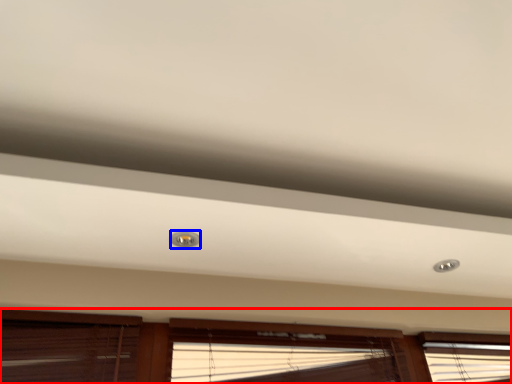
Question: Which point is further to the camera, window (highlighted by a red box) or droplight (highlighted by a blue box)?

Choices:
 (A) window
 (B) droplight

Answer: (B)